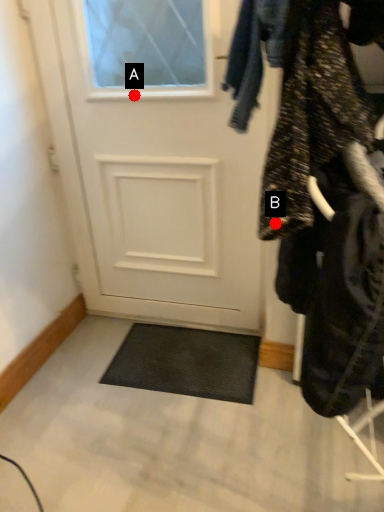
Question: Two points are circled on the image, labeled by A and B beside each circle. Which point is closer to the camera taking this photo?

Choices:
 (A) A is closer
 (B) B is closer

Answer: (B)